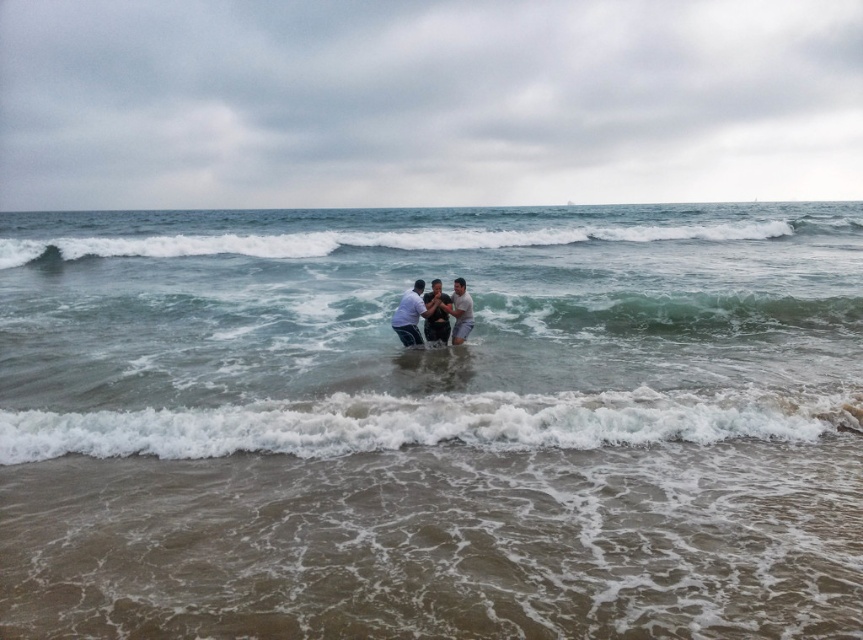
You are a photographer planning to capture a group photo of the smooth skin man at center and the white foamy wave at center. Given their spatial dimensions, will the wave appear wider than the man in the photo?

The white foamy wave at center is wider than the smooth skin man at center, so yes, the wave will appear wider in the photo.

You are a photographer trying to capture a photo of the smooth skin couple at center without the clear water at center appearing in the foreground. Is this possible based on their positions?

The clear water at center is in front of the smooth skin couple at center, so it would block the view of the couple. Therefore, it is not possible to take a photo of the smooth skin couple at center without the clear water at center appearing in the foreground.